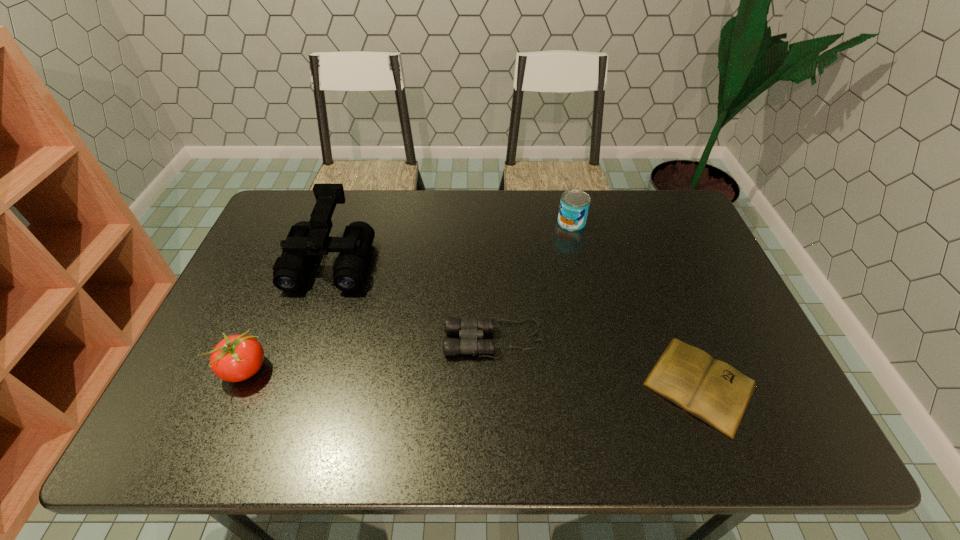
Identify the location of free spot between the tallest object and the book. (516, 322).

You are a GUI agent. You are given a task and a screenshot of the screen. Output one action in this format:
    pyautogui.click(x=<x>, y=<y>)
    Task: Click on the free space between the nearer binoculars and the tomato
    This screenshot has width=960, height=540.
    Given the screenshot: What is the action you would take?
    pyautogui.click(x=370, y=355)

You are a GUI agent. You are given a task and a screenshot of the screen. Output one action in this format:
    pyautogui.click(x=<x>, y=<y>)
    Task: Click on the free spot between the tomato and the left binoculars
    
    Given the screenshot: What is the action you would take?
    pyautogui.click(x=288, y=315)

Where is `unoccupied position between the second object from right to left and the tomato`? unoccupied position between the second object from right to left and the tomato is located at coordinates point(408,296).

In order to click on vacant space in between the right binoculars and the left binoculars in this screenshot , I will do `click(413, 299)`.

You are a GUI agent. You are given a task and a screenshot of the screen. Output one action in this format:
    pyautogui.click(x=<x>, y=<y>)
    Task: Click on the vacant region between the book and the nearer binoculars
    
    Given the screenshot: What is the action you would take?
    pyautogui.click(x=597, y=362)

This screenshot has height=540, width=960. In order to click on vacant space in between the right binoculars and the tallest object in this screenshot , I will do `click(413, 299)`.

Select which object appears as the fourth closest to the nearer binoculars. Please provide its 2D coordinates. Your answer should be formatted as a tuple, i.e. [(x, y)], where the tuple contains the x and y coordinates of a point satisfying the conditions above.

[(236, 358)]

Select which object appears as the fourth closest to the fourth object from left to right. Please provide its 2D coordinates. Your answer should be formatted as a tuple, i.e. [(x, y)], where the tuple contains the x and y coordinates of a point satisfying the conditions above.

[(236, 358)]

Locate an element on the screen. Image resolution: width=960 pixels, height=540 pixels. vacant space that satisfies the following two spatial constraints: 1. on the front side of the fourth object from left to right; 2. at the eyepiece of the second shortest object is located at coordinates (598, 339).